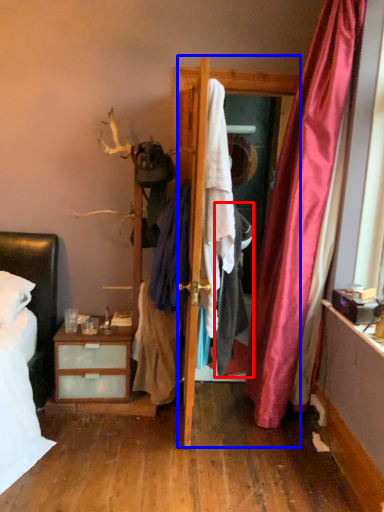
Question: Among these objects, which one is farthest to the camera, clothing (highlighted by a red box) or screen door (highlighted by a blue box)?

Choices:
 (A) clothing
 (B) screen door

Answer: (B)